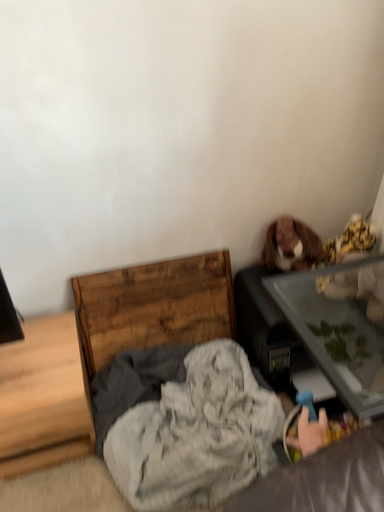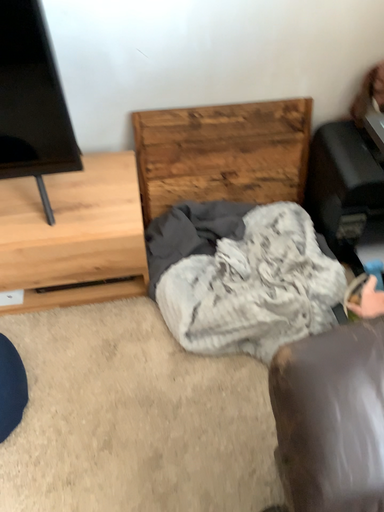
Question: Which way did the camera rotate in the video?

Choices:
 (A) rotated downward
 (B) rotated upward

Answer: (A)